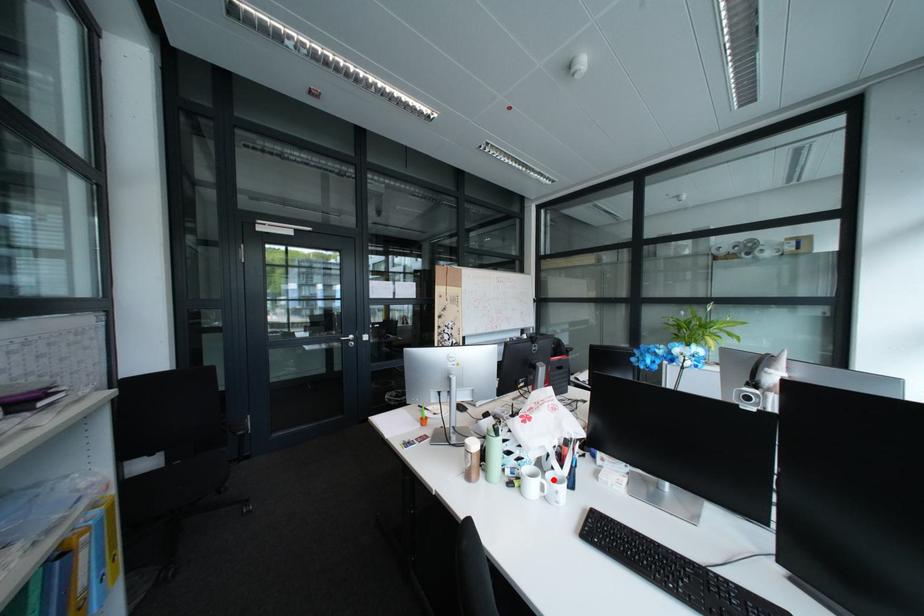
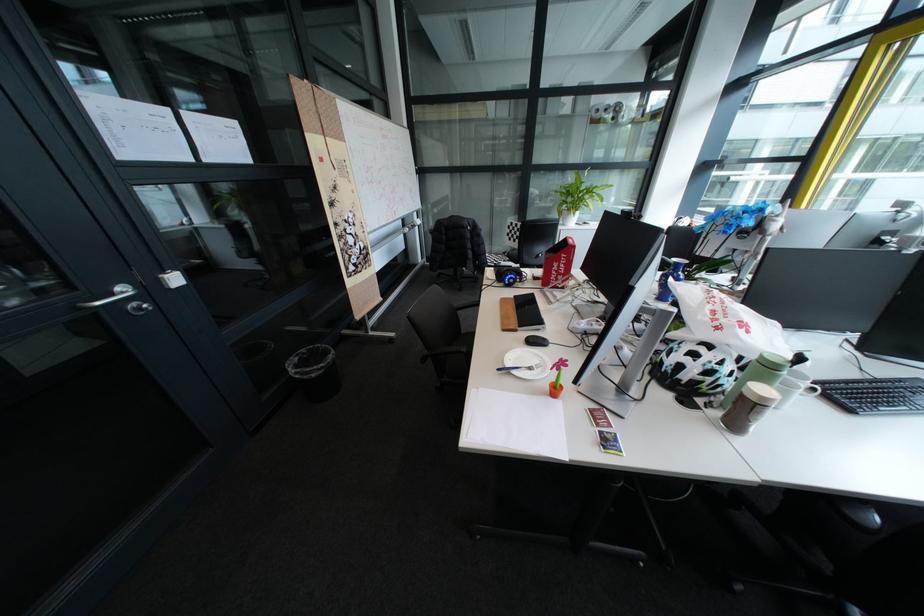
Locate, in the second image, the point that corresponds to the highlighted location in the first image.

(815, 386)